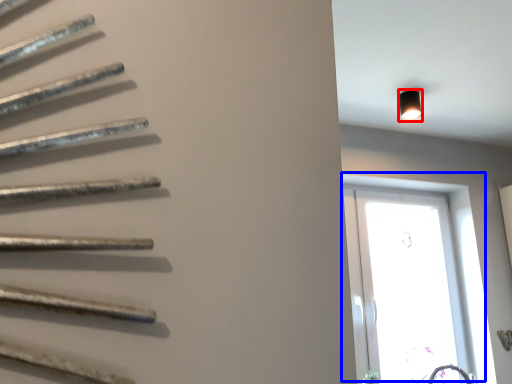
Question: Among these objects, which one is nearest to the camera, light fixture (highlighted by a red box) or window (highlighted by a blue box)?

Choices:
 (A) light fixture
 (B) window

Answer: (A)